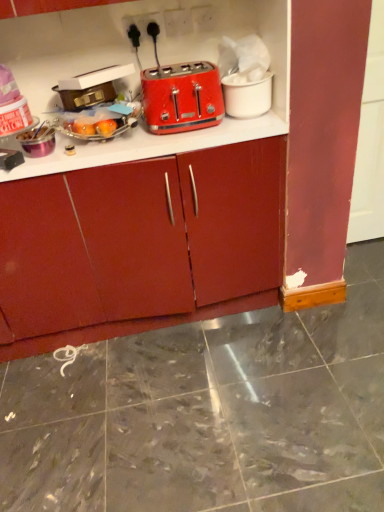
Question: Does point (233, 79) appear closer or farther from the camera than point (170, 99)?

Choices:
 (A) closer
 (B) farther

Answer: (B)

Question: In the image, is white matte cup at upper right, placed as the 2th appliance when sorted from left to right, positioned in front of or behind matte plastic toaster at upper center?

Choices:
 (A) behind
 (B) front

Answer: (A)

Question: Estimate the real-world distances between objects in this image. Which object is closer to the matte red cabinet at center?

Choices:
 (A) matte plastic toaster at upper center
 (B) metallic gold suitcase at upper left, the first appliance positioned from the left
 (C) white matte cup at upper right, which is the first appliance in right-to-left order

Answer: (A)

Question: Considering the real-world distances, which object is closest to the matte plastic toaster at upper center?

Choices:
 (A) metallic gold suitcase at upper left, the first appliance positioned from the left
 (B) matte red cabinet at center
 (C) white matte cup at upper right, which is the first appliance in right-to-left order

Answer: (C)